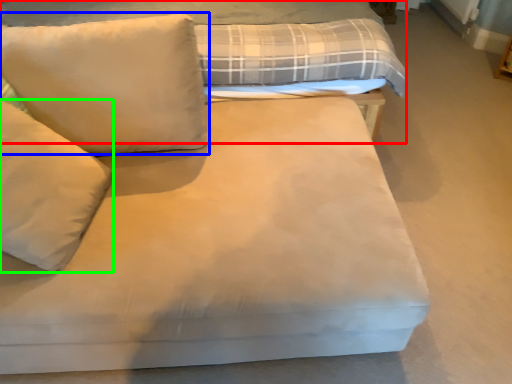
Question: Considering the real-world distances, which object is closest to bed (highlighted by a red box)? pillow (highlighted by a blue box) or pillow (highlighted by a green box).

Choices:
 (A) pillow
 (B) pillow

Answer: (A)